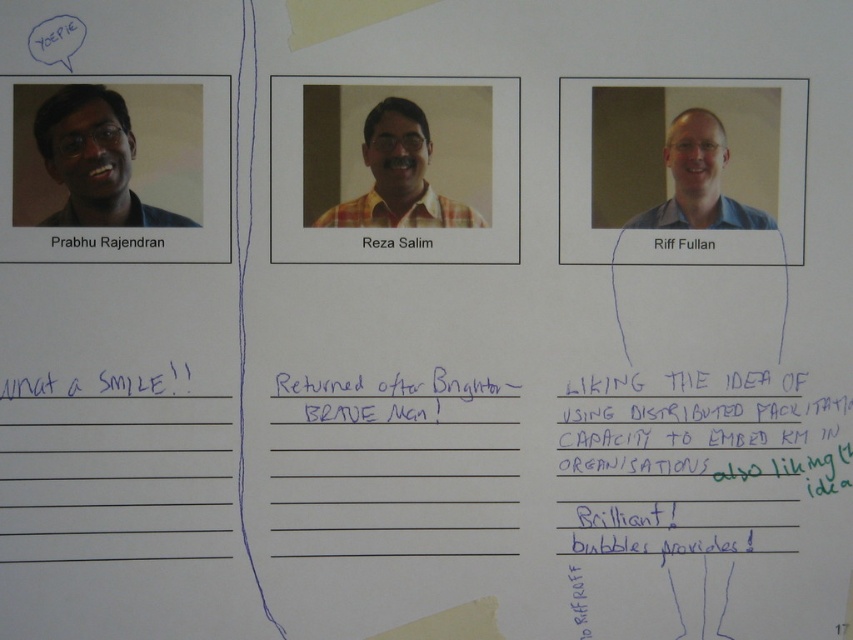
Question: Is matte black face at left smaller than yellow plaid shirt at center?

Choices:
 (A) no
 (B) yes

Answer: (A)

Question: Which point is farther to the camera?

Choices:
 (A) (714, 221)
 (B) (111, 97)

Answer: (A)

Question: From the image, what is the correct spatial relationship of matte black face at left in relation to black ink writing at center?

Choices:
 (A) above
 (B) below

Answer: (A)

Question: Which of the following is the farthest from the observer?

Choices:
 (A) blue shirt at center
 (B) matte black face at left

Answer: (A)

Question: Does black ink writing at center have a greater width compared to blue shirt at center?

Choices:
 (A) no
 (B) yes

Answer: (B)

Question: Which point appears farthest from the camera in this image?

Choices:
 (A) (384, 182)
 (B) (689, 141)
 (C) (119, 164)

Answer: (B)